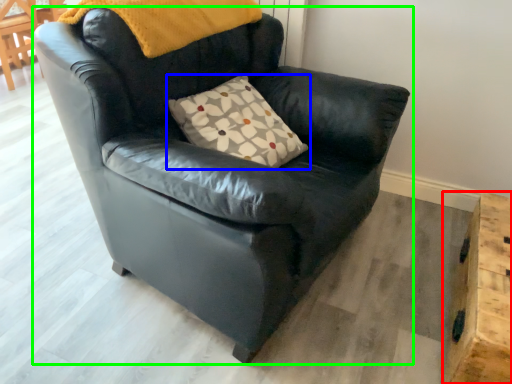
Question: Which object is the closest to the table (highlighted by a red box)? Choose among these: pillow (highlighted by a blue box) or chair (highlighted by a green box).

Choices:
 (A) pillow
 (B) chair

Answer: (B)